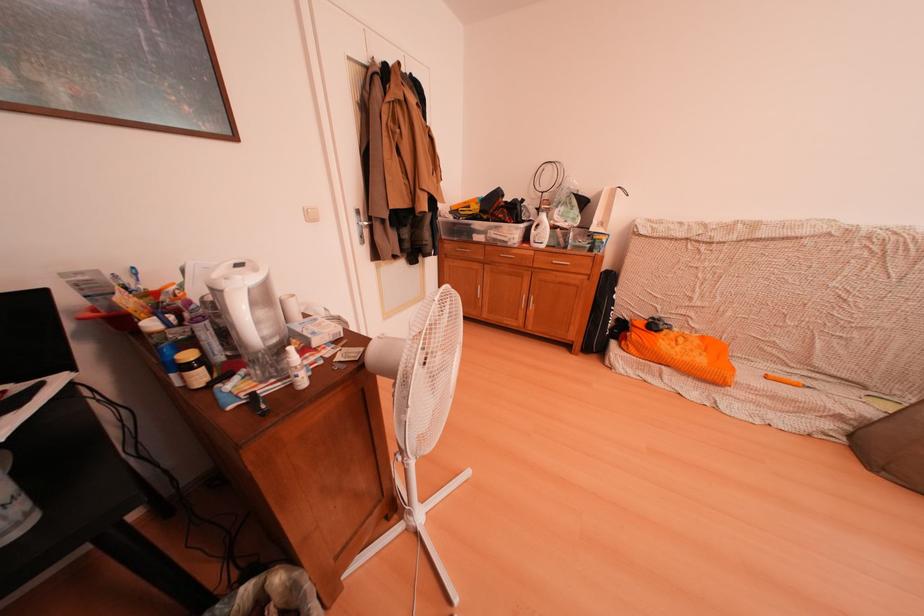
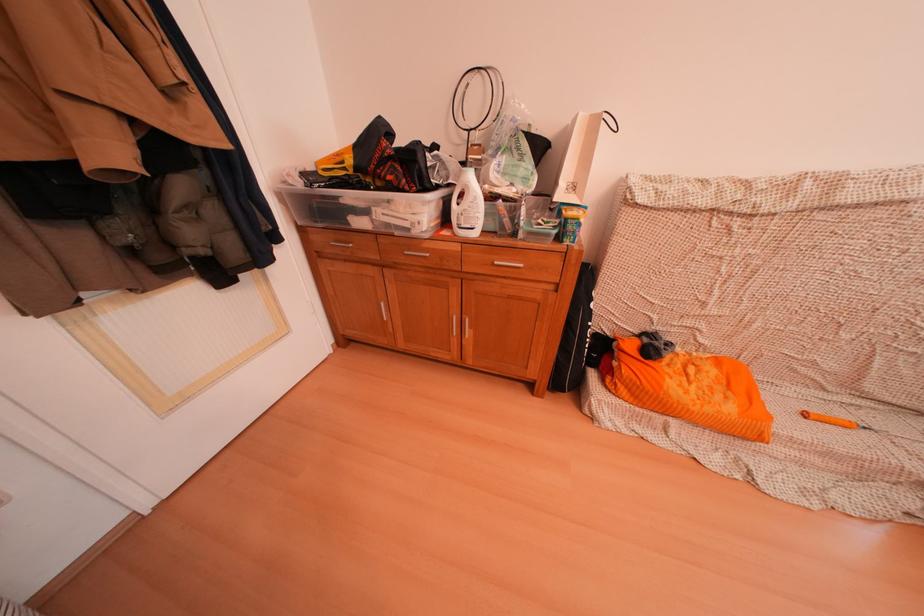
Find the pixel in the second image that matches [784,379] in the first image.

(824, 415)